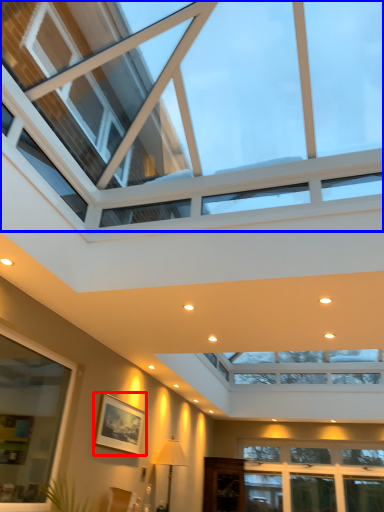
Question: Which point is further to the camera, picture frame (highlighted by a red box) or window (highlighted by a blue box)?

Choices:
 (A) picture frame
 (B) window

Answer: (A)